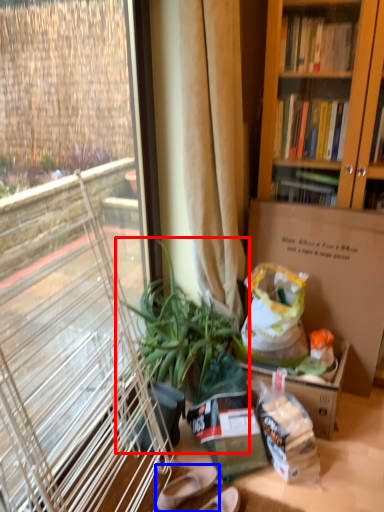
Question: Which object is closer to the camera taking this photo, houseplant (highlighted by a red box) or footwear (highlighted by a blue box)?

Choices:
 (A) houseplant
 (B) footwear

Answer: (A)